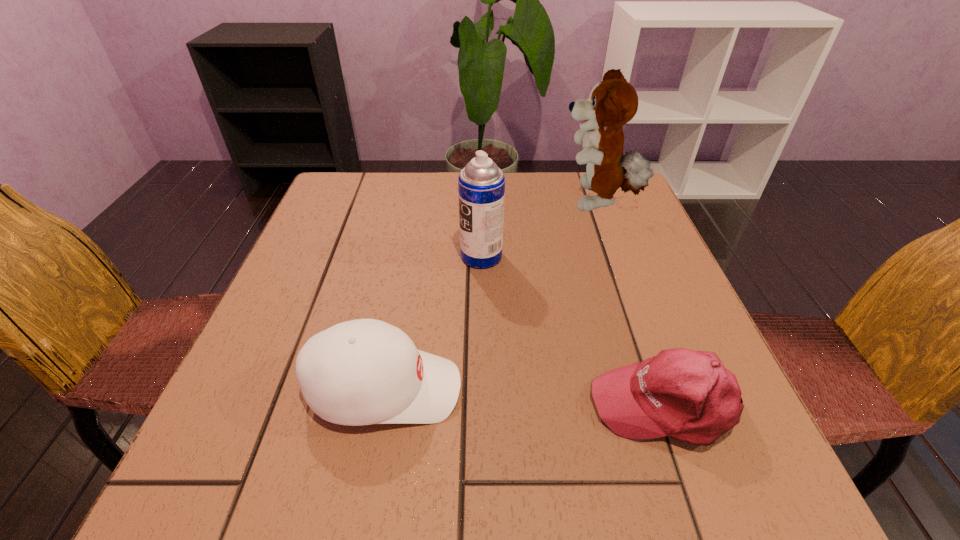
Identify which object is the second nearest to the second farthest object. Please provide its 2D coordinates. Your answer should be formatted as a tuple, i.e. [(x, y)], where the tuple contains the x and y coordinates of a point satisfying the conditions above.

[(365, 371)]

Point out which object is positioned as the nearest to the right baseball cap. Please provide its 2D coordinates. Your answer should be formatted as a tuple, i.e. [(x, y)], where the tuple contains the x and y coordinates of a point satisfying the conditions above.

[(365, 371)]